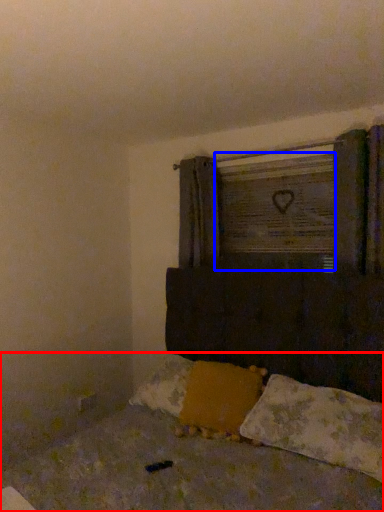
Question: Among these objects, which one is nearest to the camera, bed (highlighted by a red box) or window frame (highlighted by a blue box)?

Choices:
 (A) bed
 (B) window frame

Answer: (A)